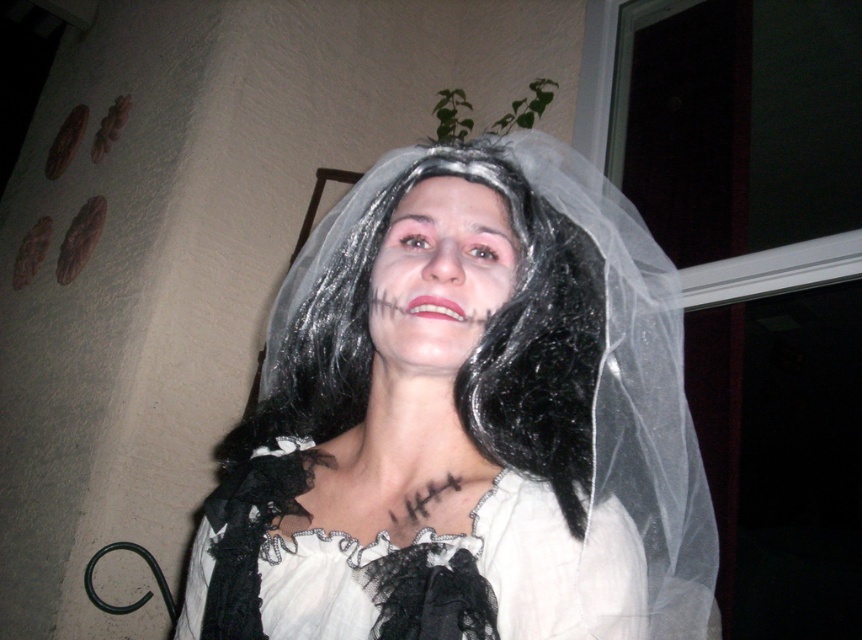
In the scene shown: Is white lace veil at center wider than white lace dress at center?

Indeed, white lace veil at center has a greater width compared to white lace dress at center.

Is point (513, 416) positioned after point (241, 589)?

Yes, point (513, 416) is farther from viewer.

Locate an element on the screen. white lace veil at center is located at coordinates (465, 420).